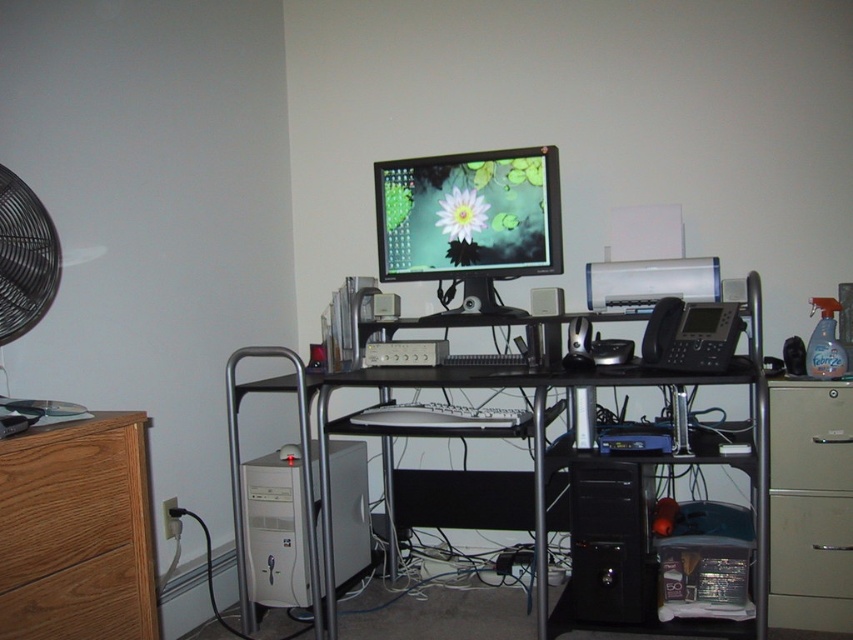
You are looking at the desk in the home office. There are two points marked on the desk surface, one at coordinates point [850,513] and another at point [711,300]. Which point is closer to you?

Point [850,513] is closer to the viewer than point [711,300].

You are navigating a small robot through the home office scene. The robot must move from the starting point at point (39, 541) to the target point (408, 237). Considering the desk layout described, will the robot have to move backward to reach the target?

The point (39, 541) is in front of point (408, 237), so the robot will need to move backward to reach the target point (408, 237) from its starting position.